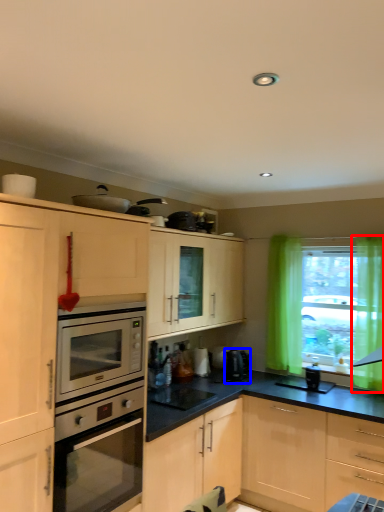
Question: Which point is closer to the camera, curtain (highlighted by a red box) or coffee machine (highlighted by a blue box)?

Choices:
 (A) curtain
 (B) coffee machine

Answer: (A)